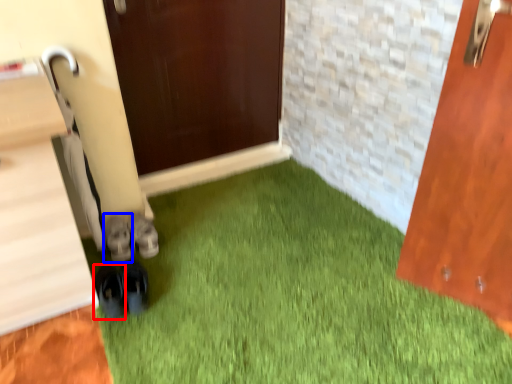
Question: Among these objects, which one is nearest to the camera, footwear (highlighted by a red box) or footwear (highlighted by a blue box)?

Choices:
 (A) footwear
 (B) footwear

Answer: (A)